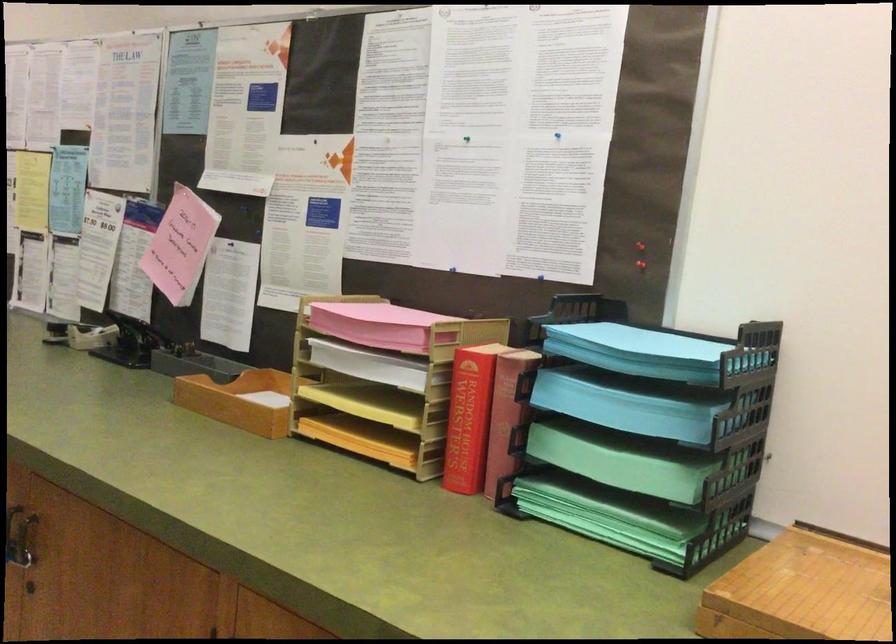
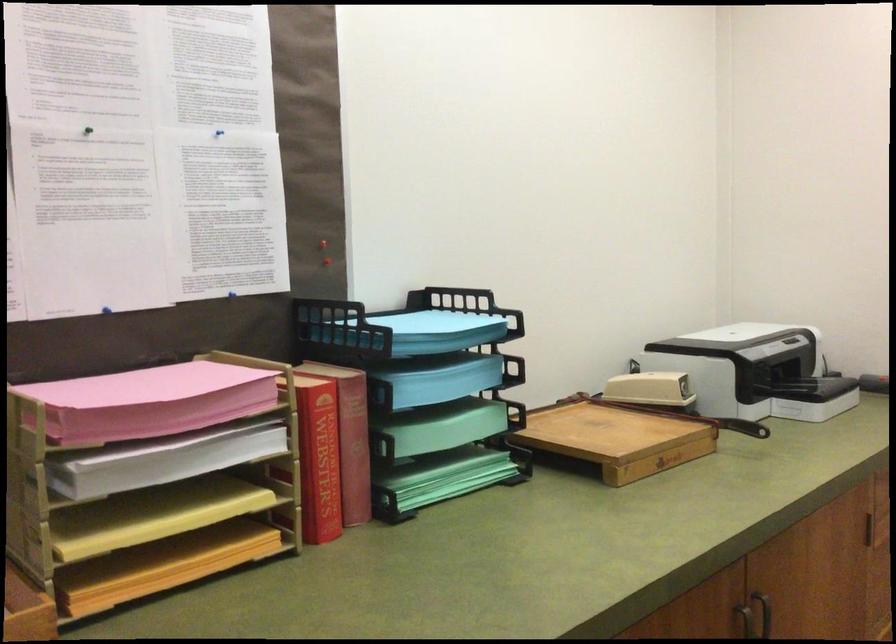
Locate, in the second image, the point that corresponds to (x=645, y=251) in the first image.

(323, 252)